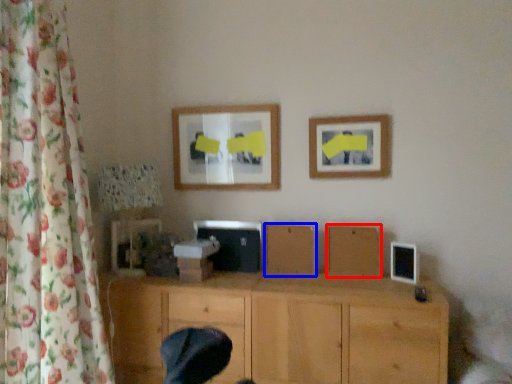
Question: Which of the following is the farthest to the observer, wood (highlighted by a red box) or wood (highlighted by a blue box)?

Choices:
 (A) wood
 (B) wood

Answer: (B)